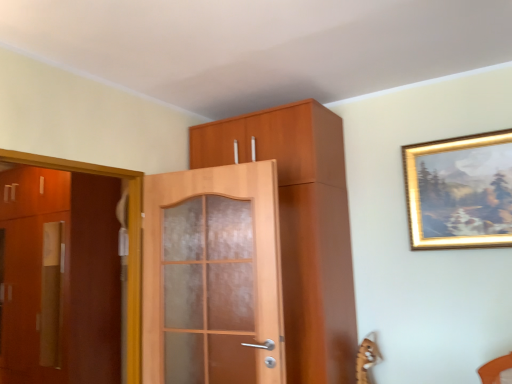
Question: Which direction should I rotate to look at matte wood door at center, which is counted as the second door, starting from the back, — up or down?

Choices:
 (A) down
 (B) up

Answer: (A)

Question: From the image's perspective, is matte brown cabinet at left, marked as the 2th door in a front-to-back arrangement, below matte wood door at center, which appears as the first door when viewed from the front?

Choices:
 (A) yes
 (B) no

Answer: (A)

Question: Is matte brown cabinet at left, the 1th door positioned from the left, thinner than matte wood door at center, which appears as the first door when viewed from the front?

Choices:
 (A) yes
 (B) no

Answer: (B)

Question: Would you consider matte brown cabinet at left, marked as the 2th door in a front-to-back arrangement, to be distant from matte wood door at center, which is counted as the second door, starting from the left?

Choices:
 (A) no
 (B) yes

Answer: (B)

Question: From the image's perspective, is matte brown cabinet at left, the 1th door positioned from the back, located above matte wood door at center, which appears as the first door when viewed from the front?

Choices:
 (A) yes
 (B) no

Answer: (B)

Question: Considering the relative positions of matte brown cabinet at left, the 1th door positioned from the back, and matte wood door at center, which is counted as the second door, starting from the back, in the image provided, is matte brown cabinet at left, the 1th door positioned from the back, to the left of matte wood door at center, which is counted as the second door, starting from the back, from the viewer's perspective?

Choices:
 (A) no
 (B) yes

Answer: (B)

Question: Does matte brown cabinet at left, the 1th door positioned from the left, lie behind matte wood door at center, which is counted as the second door, starting from the back?

Choices:
 (A) yes
 (B) no

Answer: (A)

Question: Does matte wood door at center, which is counted as the second door, starting from the left, have a lesser height compared to matte wood cabinet at center?

Choices:
 (A) no
 (B) yes

Answer: (B)

Question: From a real-world perspective, is matte wood door at center, which appears as the first door when viewed from the front, below matte wood cabinet at center?

Choices:
 (A) no
 (B) yes

Answer: (B)

Question: Does matte wood door at center, which is counted as the second door, starting from the back, have a larger size compared to matte wood cabinet at center?

Choices:
 (A) no
 (B) yes

Answer: (A)

Question: Does matte wood door at center, which appears as the first door when viewed from the front, have a smaller size compared to matte wood cabinet at center?

Choices:
 (A) no
 (B) yes

Answer: (B)

Question: Can you confirm if matte wood door at center, which is counted as the second door, starting from the left, is wider than matte wood cabinet at center?

Choices:
 (A) no
 (B) yes

Answer: (A)

Question: Is matte wood door at center, which is counted as the second door, starting from the back, positioned behind matte wood cabinet at center?

Choices:
 (A) yes
 (B) no

Answer: (B)

Question: Is matte wood cabinet at center looking in the opposite direction of matte brown cabinet at left, which is counted as the 2th door, starting from the right?

Choices:
 (A) no
 (B) yes

Answer: (A)